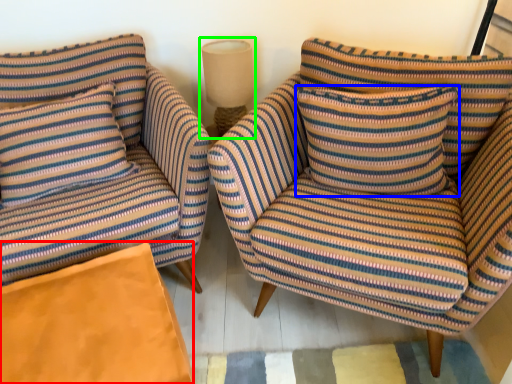
Question: Considering the real-world distances, which object is closest to material (highlighted by a red box)? pillow (highlighted by a blue box) or lamp (highlighted by a green box).

Choices:
 (A) pillow
 (B) lamp

Answer: (A)